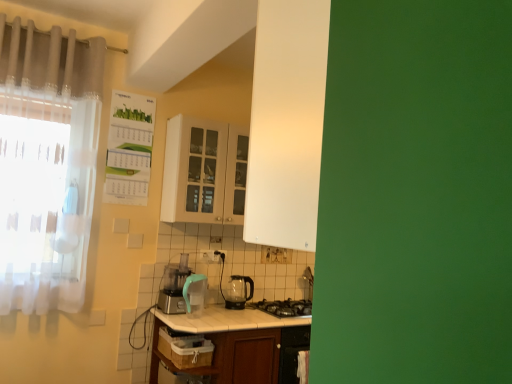
I want to click on vacant space underneath transparent glass kettle at center (from a real-world perspective), so click(239, 307).